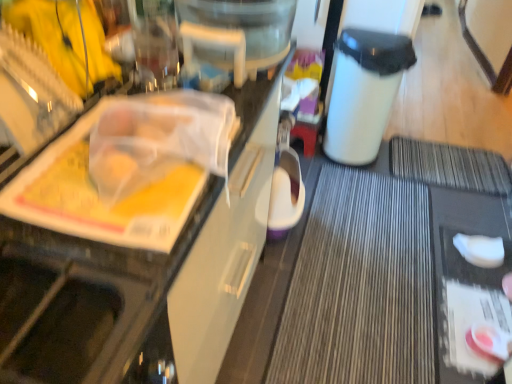
Identify the location of free space above white matte sponge at lower right, arranged as the second food when viewed from the front (from a real-world perspective). (479, 249).